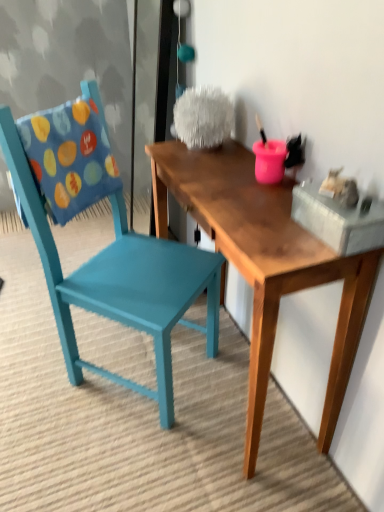
At what (x,y) coordinates should I click in order to perform the action: click on teal painted wood chair at left. Please return your answer as a coordinate pair (x, y). This screenshot has height=512, width=384. Looking at the image, I should click on (109, 245).

Locate an element on the screen. The image size is (384, 512). wooden table at center is located at coordinates (265, 262).

Image resolution: width=384 pixels, height=512 pixels. What do you see at coordinates (265, 262) in the screenshot?
I see `wooden table at center` at bounding box center [265, 262].

The width and height of the screenshot is (384, 512). I want to click on teal painted wood chair at left, so click(x=109, y=245).

Locate an element on the screen. pillow above the wooden table at center (from a real-world perspective) is located at coordinates (69, 157).

From the image's perspective, is wooden table at center located beneath blue fabric pillow at left?

Yes.

Considering the relative positions of wooden table at center and blue fabric pillow at left in the image provided, is wooden table at center to the left of blue fabric pillow at left from the viewer's perspective?

Incorrect, wooden table at center is not on the left side of blue fabric pillow at left.

Considering the positions of objects wooden table at center and blue fabric pillow at left in the image provided, who is behind, wooden table at center or blue fabric pillow at left?

blue fabric pillow at left is further away from the camera.

From the image's perspective, relative to wooden table at center, is teal painted wood chair at left above or below?

teal painted wood chair at left is above wooden table at center.

Is teal painted wood chair at left completely or partially outside of wooden table at center?

Yes, teal painted wood chair at left is not within wooden table at center.

Considering the sizes of objects wooden table at center and teal painted wood chair at left in the image provided, who is wider, wooden table at center or teal painted wood chair at left?

With larger width is teal painted wood chair at left.

Could teal painted wood chair at left be considered to be inside wooden table at center?

No, teal painted wood chair at left is located outside of wooden table at center.

From a real-world perspective, is wooden table at center located higher than teal painted wood chair at left?

No, from a real-world perspective, wooden table at center is not on top of teal painted wood chair at left.

Based on their positions, is wooden table at center located to the left or right of teal painted wood chair at left?

wooden table at center is to the right of teal painted wood chair at left.

From a real-world perspective, is teal painted wood chair at left above or below blue fabric pillow at left?

In terms of real-world spatial position, teal painted wood chair at left is below blue fabric pillow at left.

Which object is positioned more to the left, teal painted wood chair at left or blue fabric pillow at left?

From the viewer's perspective, blue fabric pillow at left appears more on the left side.

Does teal painted wood chair at left contain blue fabric pillow at left?

Yes, teal painted wood chair at left is surrounding blue fabric pillow at left.

Is teal painted wood chair at left taller or shorter than blue fabric pillow at left?

Clearly, teal painted wood chair at left is taller compared to blue fabric pillow at left.

From the image's perspective, which is below, blue fabric pillow at left or wooden table at center?

wooden table at center, from the image's perspective.

In the scene shown: Can you confirm if blue fabric pillow at left is bigger than wooden table at center?

No, blue fabric pillow at left is not bigger than wooden table at center.

Which object is positioned more to the right, blue fabric pillow at left or wooden table at center?

wooden table at center.

Is blue fabric pillow at left inside the boundaries of wooden table at center, or outside?

blue fabric pillow at left lies outside wooden table at center.

Is blue fabric pillow at left far from teal painted wood chair at left?

No, blue fabric pillow at left is not far from teal painted wood chair at left.

From the image's perspective, is blue fabric pillow at left beneath teal painted wood chair at left?

No, from the image's perspective, blue fabric pillow at left is not below teal painted wood chair at left.

This screenshot has height=512, width=384. In order to click on chair that is on the right side of blue fabric pillow at left in this screenshot , I will do `click(109, 245)`.

Is blue fabric pillow at left wider or thinner than teal painted wood chair at left?

blue fabric pillow at left is thinner than teal painted wood chair at left.

At what (x,y) coordinates should I click in order to perform the action: click on table in front of the blue fabric pillow at left. Please return your answer as a coordinate pair (x, y). Looking at the image, I should click on (265, 262).

At what (x,y) coordinates should I click in order to perform the action: click on chair above the wooden table at center (from a real-world perspective). Please return your answer as a coordinate pair (x, y). Looking at the image, I should click on (109, 245).

Consider the image. Estimate the real-world distances between objects in this image. Which object is closer to teal painted wood chair at left, blue fabric pillow at left or wooden table at center?

blue fabric pillow at left is closer to teal painted wood chair at left.

Based on their spatial positions, is teal painted wood chair at left or wooden table at center further from blue fabric pillow at left?

wooden table at center lies further to blue fabric pillow at left than the other object.

Which object lies further to the anchor point blue fabric pillow at left, wooden table at center or teal painted wood chair at left?

wooden table at center.

Considering their positions, is teal painted wood chair at left positioned further to wooden table at center than blue fabric pillow at left?

Among the two, blue fabric pillow at left is located further to wooden table at center.

From the image, which object appears to be farther from wooden table at center, blue fabric pillow at left or teal painted wood chair at left?

blue fabric pillow at left is further to wooden table at center.

Consider the image. When comparing their distances from teal painted wood chair at left, does wooden table at center or blue fabric pillow at left seem closer?

blue fabric pillow at left lies closer to teal painted wood chair at left than the other object.

Identify the location of chair between blue fabric pillow at left and wooden table at center in the horizontal direction. The width and height of the screenshot is (384, 512). (109, 245).